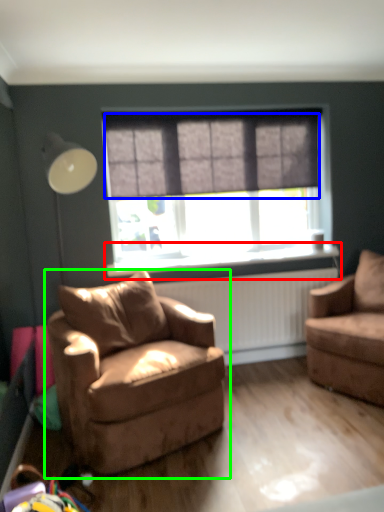
Question: Which is nearer to the window sill (highlighted by a red box)? curtain (highlighted by a blue box) or chair (highlighted by a green box).

Choices:
 (A) curtain
 (B) chair

Answer: (A)